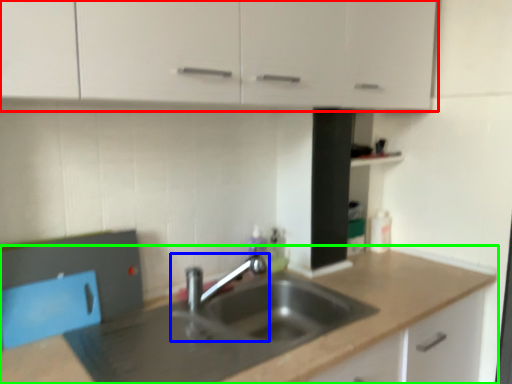
Question: Considering the real-world distances, which object is closest to cabinetry (highlighted by a red box)? tap (highlighted by a blue box) or countertop (highlighted by a green box).

Choices:
 (A) tap
 (B) countertop

Answer: (A)